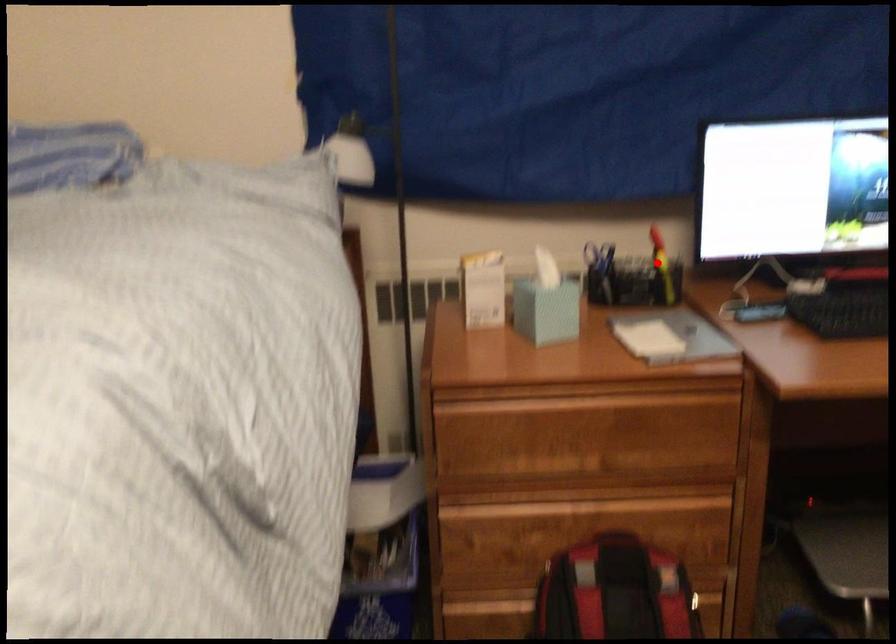
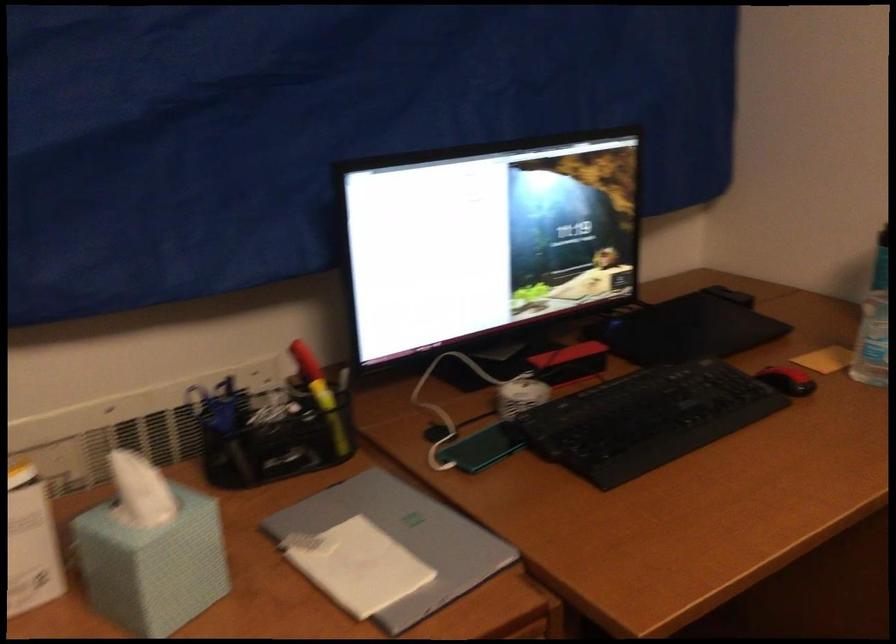
Question: A red point is marked in image1. In image2, is the corresponding 3D point closer to the camera or farther? Reply with the corresponding letter.

Choices:
 (A) The corresponding 3D point is closer.
 (B) The corresponding 3D point is farther.

Answer: (A)